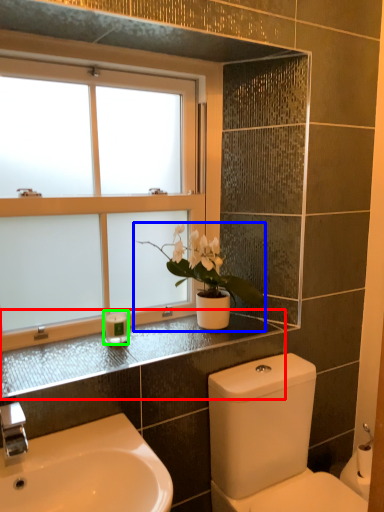
Question: Considering the real-world distances, which object is closest to counter top (highlighted by a red box)? houseplant (highlighted by a blue box) or toiletry (highlighted by a green box).

Choices:
 (A) houseplant
 (B) toiletry

Answer: (B)